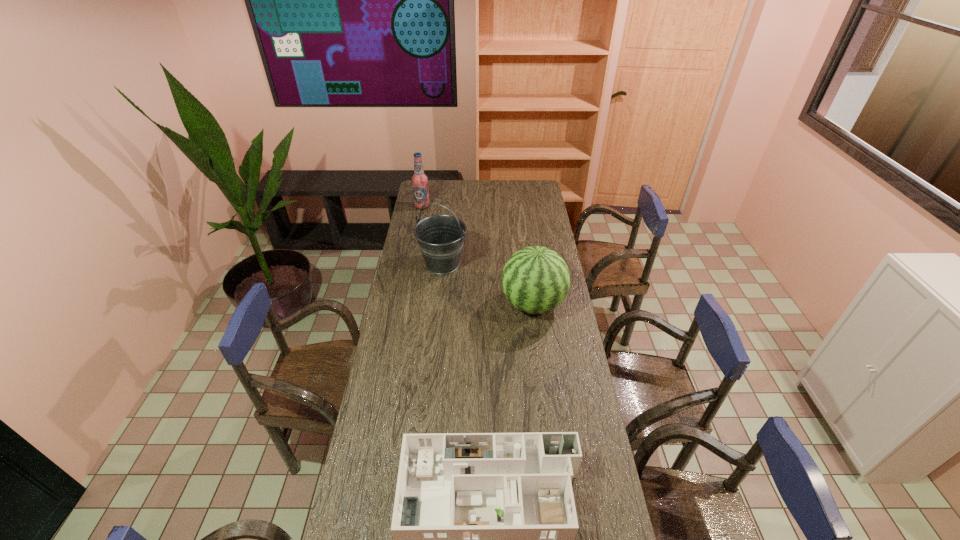
Image resolution: width=960 pixels, height=540 pixels. What are the coordinates of `free region at the left edge of the desktop` in the screenshot? It's located at (379, 539).

Image resolution: width=960 pixels, height=540 pixels. What are the coordinates of `vacant region at the right edge of the desktop` in the screenshot? It's located at (552, 369).

Locate an element on the screen. empty space that is in between the watermelon and the bucket is located at coordinates (488, 284).

This screenshot has height=540, width=960. I want to click on free space between the second nearest object and the bucket, so click(488, 284).

Where is `vacant point located between the alcohol and the third farthest object`? Image resolution: width=960 pixels, height=540 pixels. vacant point located between the alcohol and the third farthest object is located at coordinates (478, 255).

Locate an element on the screen. This screenshot has height=540, width=960. empty location between the watermelon and the third nearest object is located at coordinates (488, 284).

Locate an element on the screen. The image size is (960, 540). empty space that is in between the second farthest object and the watermelon is located at coordinates (488, 284).

Find the location of `free space that is in between the farthest object and the watermelon`. free space that is in between the farthest object and the watermelon is located at coordinates (478, 255).

Locate which object ranks in proximity to the farthest object. Please provide its 2D coordinates. Your answer should be formatted as a tuple, i.e. [(x, y)], where the tuple contains the x and y coordinates of a point satisfying the conditions above.

[(440, 238)]

Point out which object is positioned as the second nearest to the third farthest object. Please provide its 2D coordinates. Your answer should be formatted as a tuple, i.e. [(x, y)], where the tuple contains the x and y coordinates of a point satisfying the conditions above.

[(484, 524)]